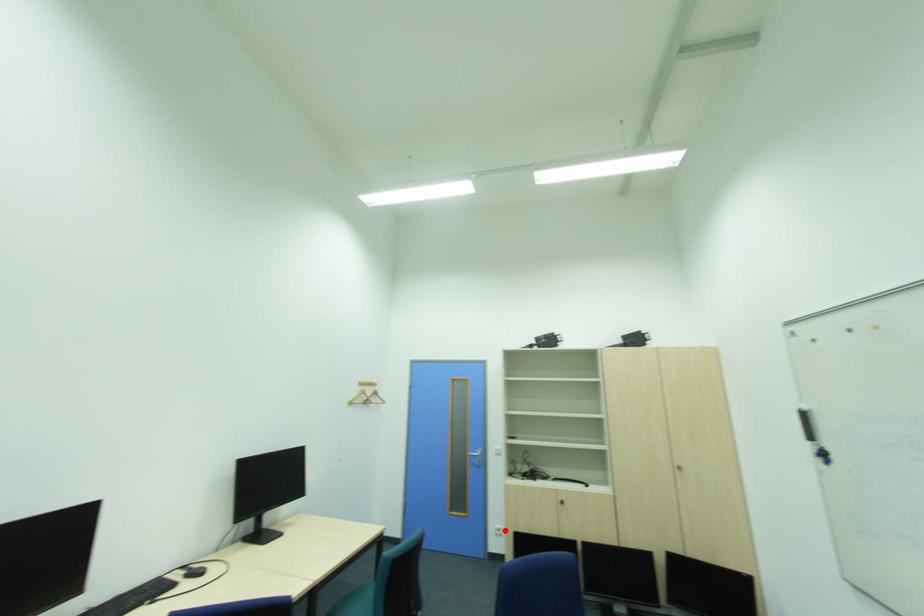
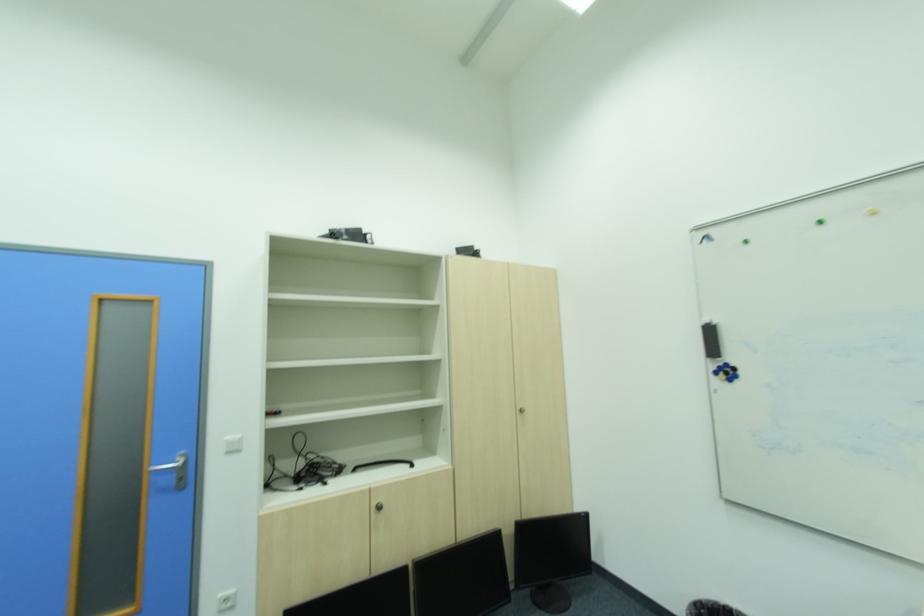
Question: I am providing you with two images of the same scene from different viewpoints. Given a red point in image1, look at the same physical point in image2. Is it:

Choices:
 (A) Closer to the viewpoint
 (B) Farther from the viewpoint

Answer: (A)